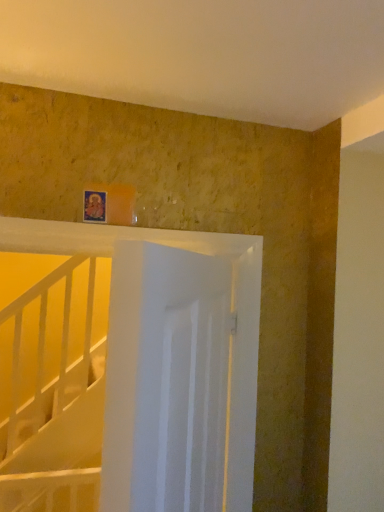
In order to face white glossy door at center, should I rotate leftwards or rightwards?

To align with it, rotate left about 0.794°.

Describe the element at coordinates (186, 370) in the screenshot. I see `white glossy door at center` at that location.

The width and height of the screenshot is (384, 512). In order to click on white glossy door at center in this screenshot , I will do 186,370.

You are a GUI agent. You are given a task and a screenshot of the screen. Output one action in this format:
    pyautogui.click(x=<x>, y=<y>)
    Task: Click on the white glossy door at center
    
    Given the screenshot: What is the action you would take?
    pyautogui.click(x=186, y=370)